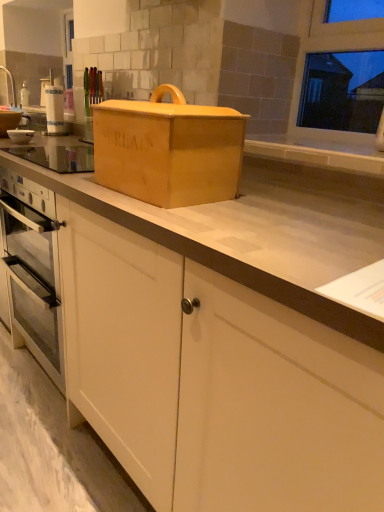
Question: Is white matte cabinet at lower center completely or partially inside matte wooden bread box at center?

Choices:
 (A) no
 (B) yes

Answer: (A)

Question: Does matte wooden bread box at center have a lesser height compared to white matte cabinet at lower center?

Choices:
 (A) no
 (B) yes

Answer: (A)

Question: Is the surface of matte wooden bread box at center in direct contact with white matte cabinet at lower center?

Choices:
 (A) no
 (B) yes

Answer: (A)

Question: Does matte wooden bread box at center appear on the left side of white matte cabinet at lower center?

Choices:
 (A) yes
 (B) no

Answer: (B)

Question: Does matte wooden bread box at center turn towards white matte cabinet at lower center?

Choices:
 (A) yes
 (B) no

Answer: (B)

Question: Is matte wooden bread box at center positioned with its back to white matte cabinet at lower center?

Choices:
 (A) yes
 (B) no

Answer: (B)

Question: Considering the relative sizes of white glossy bowl at left and white glossy sink at upper left in the image provided, is white glossy bowl at left taller than white glossy sink at upper left?

Choices:
 (A) yes
 (B) no

Answer: (B)

Question: From a real-world perspective, is white glossy bowl at left located higher than white glossy sink at upper left?

Choices:
 (A) no
 (B) yes

Answer: (A)

Question: From a real-world perspective, is white glossy bowl at left beneath white glossy sink at upper left?

Choices:
 (A) yes
 (B) no

Answer: (A)

Question: Is white glossy sink at upper left a part of white glossy bowl at left?

Choices:
 (A) no
 (B) yes

Answer: (A)

Question: Considering the relative sizes of white glossy bowl at left and white glossy sink at upper left in the image provided, is white glossy bowl at left bigger than white glossy sink at upper left?

Choices:
 (A) no
 (B) yes

Answer: (A)

Question: Does white glossy bowl at left come behind white glossy sink at upper left?

Choices:
 (A) yes
 (B) no

Answer: (B)

Question: Considering the relative positions of matte wooden bread box at center and white glossy bowl at left in the image provided, is matte wooden bread box at center to the right of white glossy bowl at left from the viewer's perspective?

Choices:
 (A) yes
 (B) no

Answer: (A)